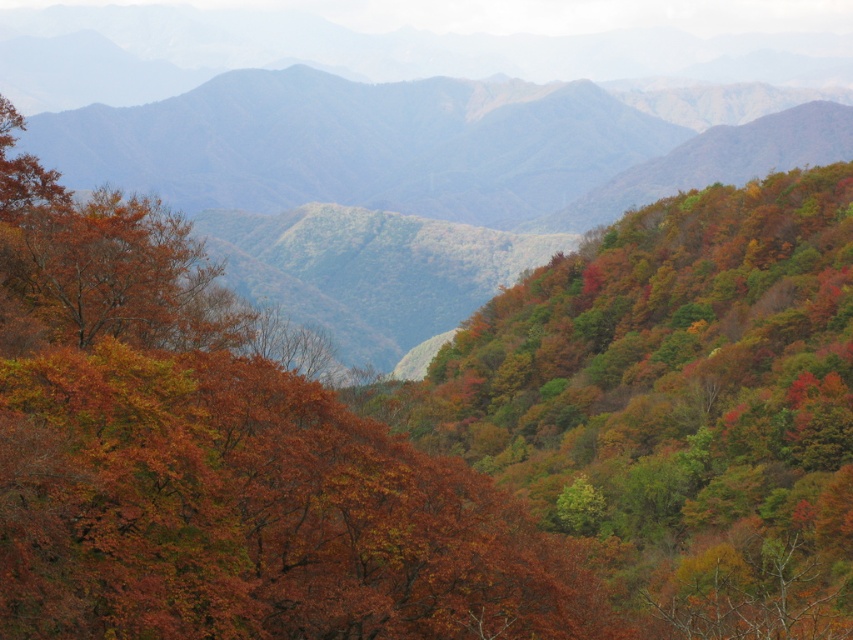
Based on the photo, which of these two, autumn leaves at center or multicolored foliage at center, stands shorter?

With less height is autumn leaves at center.

Measure the distance between autumn leaves at center and camera.

autumn leaves at center and camera are 44.56 meters apart.

At what (x,y) coordinates should I click in order to perform the action: click on autumn leaves at center. Please return your answer as a coordinate pair (x, y). Image resolution: width=853 pixels, height=640 pixels. Looking at the image, I should click on (221, 460).